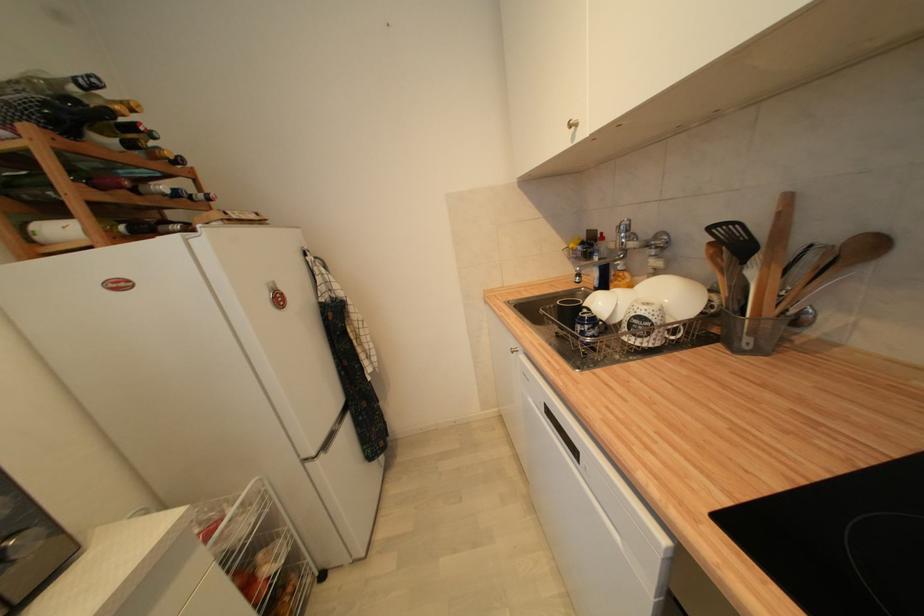
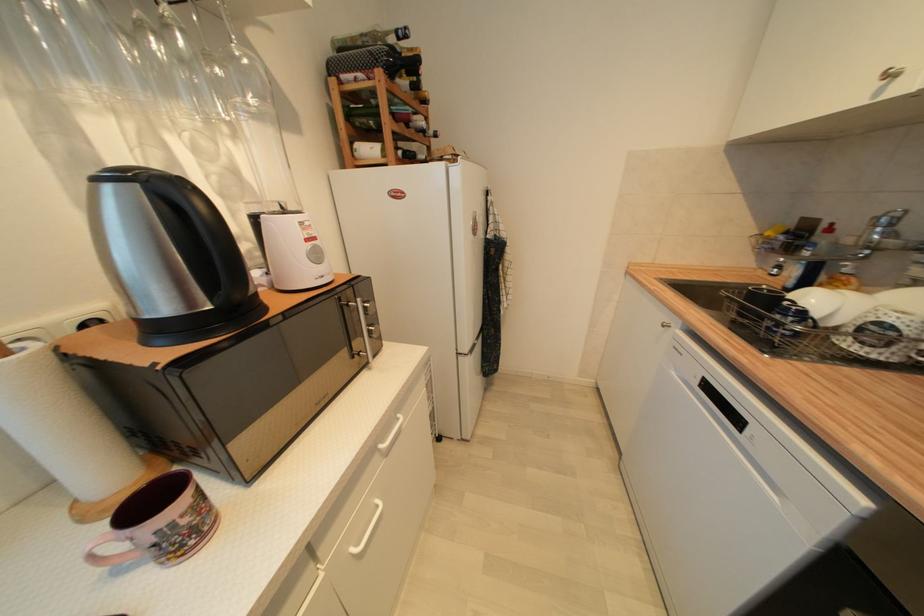
Question: The first image is from the beginning of the video and the second image is from the end. How did the camera likely rotate when shooting the video?

Choices:
 (A) Left
 (B) Right
 (C) Up
 (D) Down

Answer: (A)